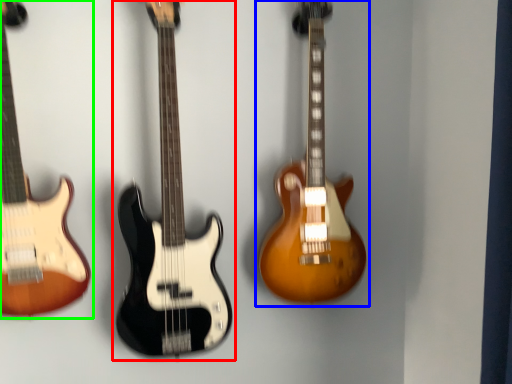
Question: Considering the real-world distances, which object is farthest from guitar (highlighted by a red box)? guitar (highlighted by a blue box) or guitar (highlighted by a green box)?

Choices:
 (A) guitar
 (B) guitar

Answer: (A)